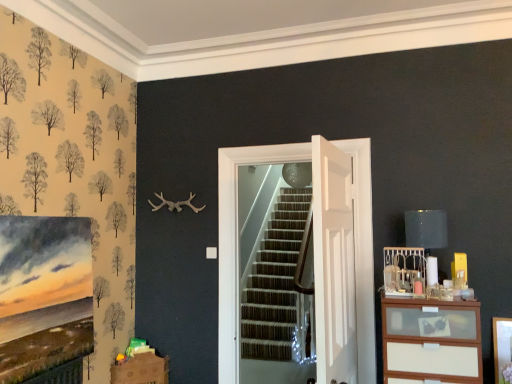
Question: Is matte black lampshade at upper right located outside brown cardboard drawer at lower left?

Choices:
 (A) no
 (B) yes

Answer: (B)

Question: Is the depth of matte black lampshade at upper right greater than that of brown cardboard drawer at lower left?

Choices:
 (A) yes
 (B) no

Answer: (B)

Question: Is matte black lampshade at upper right closer to the viewer compared to brown cardboard drawer at lower left?

Choices:
 (A) no
 (B) yes

Answer: (B)

Question: Is matte black lampshade at upper right smaller than brown cardboard drawer at lower left?

Choices:
 (A) no
 (B) yes

Answer: (B)

Question: From a real-world perspective, is matte black lampshade at upper right positioned over brown cardboard drawer at lower left based on gravity?

Choices:
 (A) no
 (B) yes

Answer: (B)

Question: Can you confirm if matte black lampshade at upper right is thinner than brown cardboard drawer at lower left?

Choices:
 (A) no
 (B) yes

Answer: (B)

Question: Is brown cardboard drawer at lower left located outside white wooden door at center, the first door from the back?

Choices:
 (A) yes
 (B) no

Answer: (A)

Question: From the image's perspective, is brown cardboard drawer at lower left over white wooden door at center, which appears as the second door when viewed from the front?

Choices:
 (A) no
 (B) yes

Answer: (A)

Question: Considering the relative sizes of brown cardboard drawer at lower left and white wooden door at center, which appears as the second door when viewed from the front, in the image provided, is brown cardboard drawer at lower left thinner than white wooden door at center, which appears as the second door when viewed from the front,?

Choices:
 (A) no
 (B) yes

Answer: (A)

Question: Does brown cardboard drawer at lower left come in front of white wooden door at center, which appears as the second door when viewed from the front?

Choices:
 (A) no
 (B) yes

Answer: (A)

Question: Does brown cardboard drawer at lower left have a greater height compared to white wooden door at center, the first door from the back?

Choices:
 (A) yes
 (B) no

Answer: (B)

Question: Is brown cardboard drawer at lower left positioned far away from white wooden door at center, the first door from the back?

Choices:
 (A) yes
 (B) no

Answer: (A)

Question: Is brown cardboard drawer at lower left bigger than white wood chest of drawers at right?

Choices:
 (A) yes
 (B) no

Answer: (B)